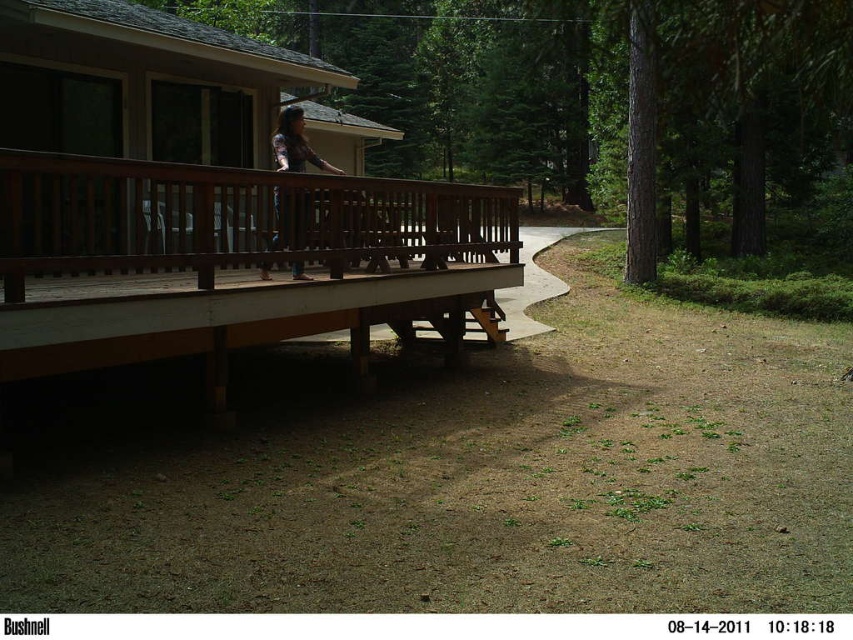
Question: Which point appears closest to the camera in this image?

Choices:
 (A) (152, 292)
 (B) (64, 195)

Answer: (B)

Question: From the image, what is the correct spatial relationship of brown wooden porch at upper left in relation to brown wooden cabin at upper left?

Choices:
 (A) left
 (B) right

Answer: (B)

Question: Is brown wooden cabin at upper left to the right of matte brown hair at center from the viewer's perspective?

Choices:
 (A) yes
 (B) no

Answer: (B)

Question: Is brown wooden porch at upper left to the left of matte brown hair at center from the viewer's perspective?

Choices:
 (A) no
 (B) yes

Answer: (B)

Question: Which object appears farthest from the camera in this image?

Choices:
 (A) brown wooden porch at upper left
 (B) brown wooden cabin at upper left

Answer: (B)

Question: Which object is farther from the camera taking this photo?

Choices:
 (A) brown wooden cabin at upper left
 (B) matte brown hair at center
 (C) brown wooden porch at upper left

Answer: (B)